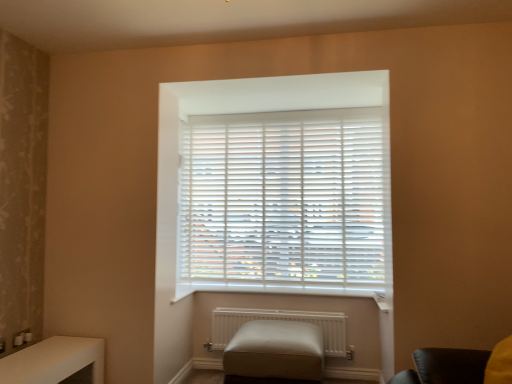
Question: Does white matte radiator at lower center appear on the right side of white matte blinds at center?

Choices:
 (A) yes
 (B) no

Answer: (B)

Question: Is there a large distance between white matte radiator at lower center and white matte blinds at center?

Choices:
 (A) yes
 (B) no

Answer: (B)

Question: Is white matte radiator at lower center not inside white matte blinds at center?

Choices:
 (A) no
 (B) yes

Answer: (B)

Question: Can you confirm if white matte radiator at lower center is thinner than white matte blinds at center?

Choices:
 (A) yes
 (B) no

Answer: (B)

Question: From a real-world perspective, is white matte radiator at lower center physically above white matte blinds at center?

Choices:
 (A) yes
 (B) no

Answer: (B)

Question: Does white matte radiator at lower center lie in front of white matte blinds at center?

Choices:
 (A) no
 (B) yes

Answer: (B)

Question: Does white glossy table at lower left have a lesser width compared to beige leather ottoman at center?

Choices:
 (A) yes
 (B) no

Answer: (A)

Question: Is white glossy table at lower left directly adjacent to beige leather ottoman at center?

Choices:
 (A) yes
 (B) no

Answer: (B)

Question: Is white glossy table at lower left behind beige leather ottoman at center?

Choices:
 (A) yes
 (B) no

Answer: (B)

Question: Is white glossy table at lower left bigger than beige leather ottoman at center?

Choices:
 (A) no
 (B) yes

Answer: (A)

Question: Does white glossy table at lower left appear on the right side of beige leather ottoman at center?

Choices:
 (A) yes
 (B) no

Answer: (B)

Question: From the image's perspective, is white glossy table at lower left below beige leather ottoman at center?

Choices:
 (A) yes
 (B) no

Answer: (B)

Question: From a real-world perspective, is white matte blinds at center physically above beige leather ottoman at center?

Choices:
 (A) yes
 (B) no

Answer: (A)